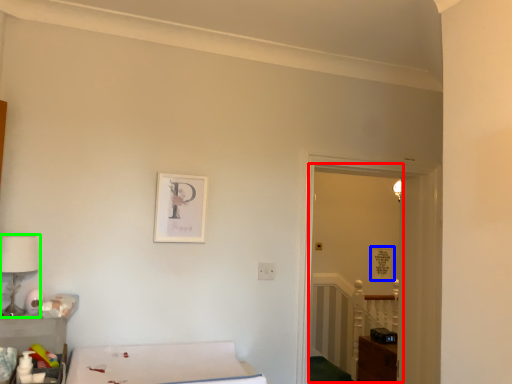
Question: Considering the real-world distances, which object is farthest from glass door (highlighted by a red box)? picture frame (highlighted by a blue box) or table lamp (highlighted by a green box)?

Choices:
 (A) picture frame
 (B) table lamp

Answer: (B)